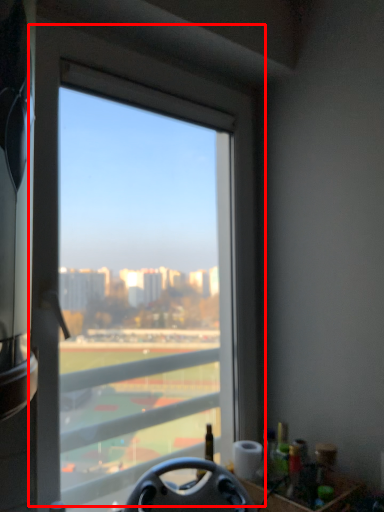
Question: From the image, what is the correct spatial relationship of window (annotated by the red box) in relation to steering wheel?

Choices:
 (A) right
 (B) left

Answer: (B)